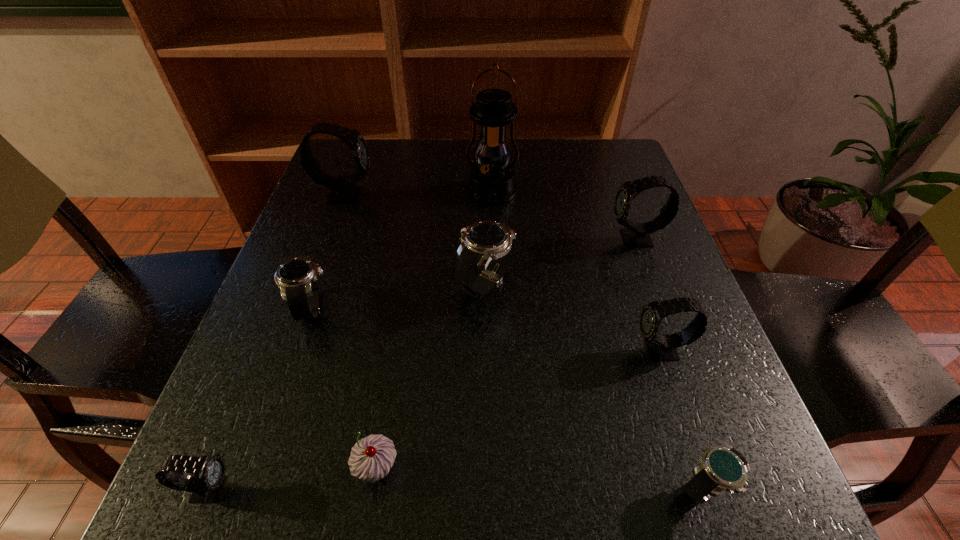
At what (x,y) coordinates should I click in order to perform the action: click on lantern. Please return your answer as a coordinate pair (x, y). The width and height of the screenshot is (960, 540). Looking at the image, I should click on (491, 182).

This screenshot has height=540, width=960. I want to click on black lantern, so click(491, 182).

Locate an element on the screen. The image size is (960, 540). the biggest gray watch is located at coordinates (343, 191).

Locate an element on the screen. This screenshot has width=960, height=540. the farthest watch is located at coordinates (343, 191).

Identify the location of the third tallest object. The image size is (960, 540). (636, 234).

The image size is (960, 540). Identify the location of the second tallest watch. (636, 234).

Where is `the biggest silver watch`? This screenshot has height=540, width=960. the biggest silver watch is located at coordinates (482, 242).

The width and height of the screenshot is (960, 540). I want to click on the fourth watch from left to right, so click(x=482, y=242).

Identify the location of the fifth farthest watch. (661, 347).

You are a GUI agent. You are given a task and a screenshot of the screen. Output one action in this format:
    pyautogui.click(x=<x>, y=<y>)
    Task: Click on the third farthest gray watch
    Image resolution: width=960 pixels, height=540 pixels.
    Given the screenshot: What is the action you would take?
    pyautogui.click(x=661, y=347)